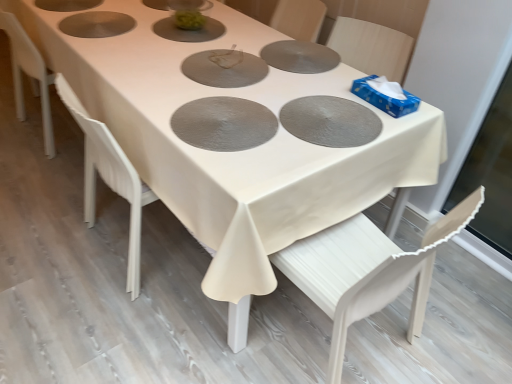
Where is `free space between textured silver pizza pan at center, which is counted as the third pizza pan, starting from the top, and matte gray pizza pan at center, which is the 2th pizza pan from top to bottom`? This screenshot has height=384, width=512. free space between textured silver pizza pan at center, which is counted as the third pizza pan, starting from the top, and matte gray pizza pan at center, which is the 2th pizza pan from top to bottom is located at coordinates (271, 117).